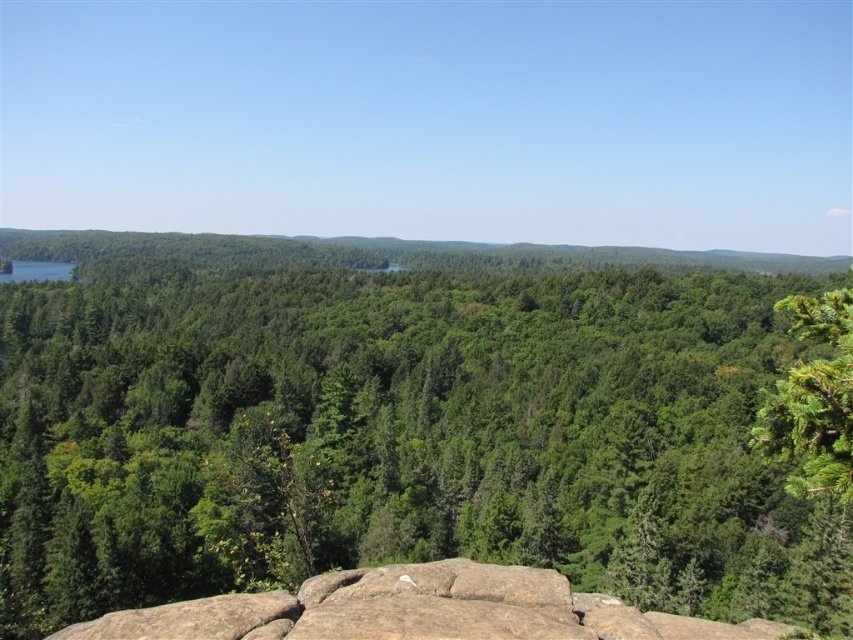
You are standing at the viewpoint overlooking the forest. There are two points marked in the image. Which of the two points, point (x=466, y=634) or point (x=851, y=403), is closer to your current position?

Point (x=466, y=634) is further to the camera than point (x=851, y=403), so the point closer to your current position is point (x=851, y=403).

Based on the photo, you are a hiker who wants to take a photo of the green leafy forest at center and the green textured pine tree at right. Which object should you focus on first if you want to capture both in one frame without moving your camera?

The green leafy forest at center is larger in size than the green textured pine tree at right, so you should focus on the green leafy forest at center first to ensure it fills the frame appropriately before adjusting for the pine tree.

You are standing on a cliff overlooking the green leafy forest at center. You want to throw a small rock so it lands exactly at the base of the forest. If your throwing range is up to 12 meters, will you be able to reach the forest with your throw?

The green leafy forest at center is 12.36 meters away from the viewer. Since your throwing range is up to 12 meters, you will not be able to reach the forest with your throw as the distance exceeds your maximum range.